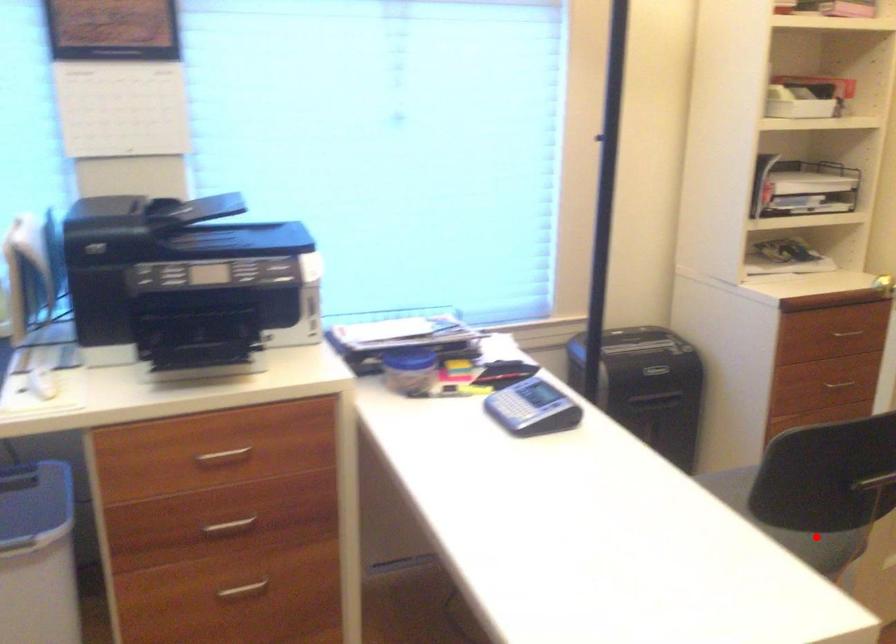
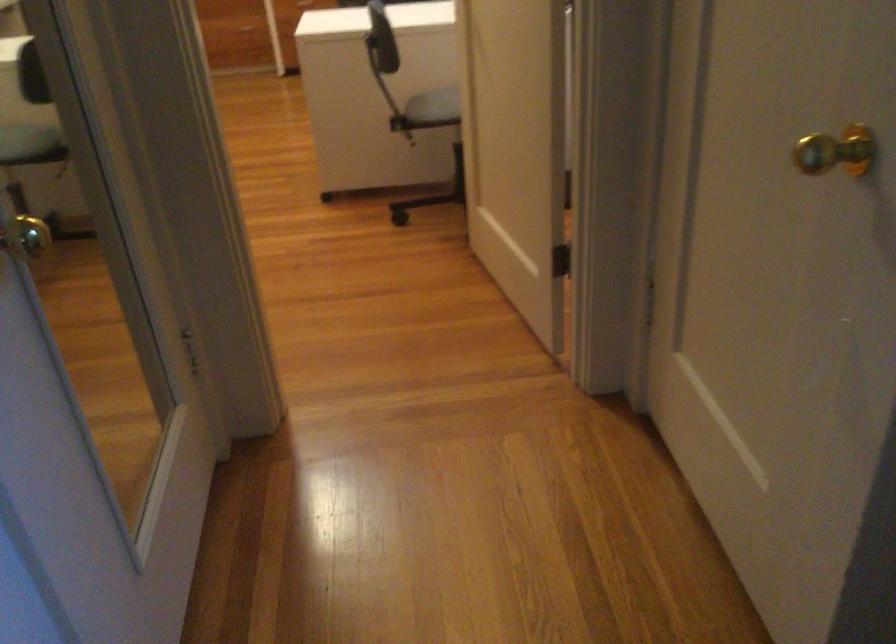
Question: I am providing you with two images of the same scene from different viewpoints. In image1, a red point is highlighted. Considering the same 3D point in image2, which of the following is correct?

Choices:
 (A) It is closer
 (B) It is farther

Answer: (B)